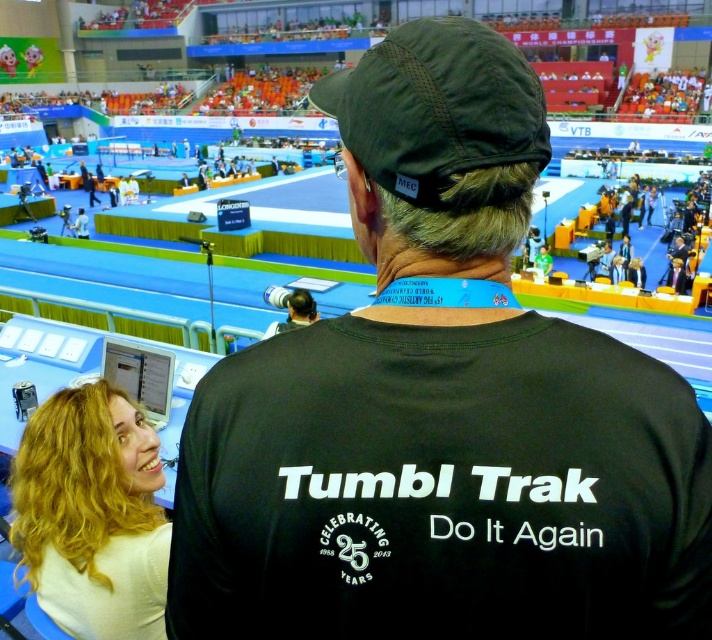
Between black fabric shirt at center and blonde hair at upper left, which one appears on the left side from the viewer's perspective?

Positioned to the left is blonde hair at upper left.

Based on the photo, is black fabric shirt at center below blonde hair at upper left?

Actually, black fabric shirt at center is above blonde hair at upper left.

In order to click on black fabric shirt at center in this screenshot , I will do `click(441, 408)`.

Which is in front, point (439, 68) or point (323, 100)?

Positioned in front is point (439, 68).

Is black fabric shirt at center below dark green fabric baseball cap at upper center?

Indeed, black fabric shirt at center is positioned under dark green fabric baseball cap at upper center.

Between point (436, 122) and point (392, 65), which one is positioned behind?

The point (392, 65) is more distant.

Identify the location of black fabric shirt at center. (441, 408).

Who is positioned more to the right, blonde hair at upper left or dark green fabric baseball cap at upper center?

Positioned to the right is dark green fabric baseball cap at upper center.

Is blonde hair at upper left closer to the viewer compared to dark green fabric baseball cap at upper center?

No, it is not.

Who is more forward, [46,461] or [481,93]?

Point [481,93] is more forward.

The image size is (712, 640). I want to click on blonde hair at upper left, so click(x=93, y=515).